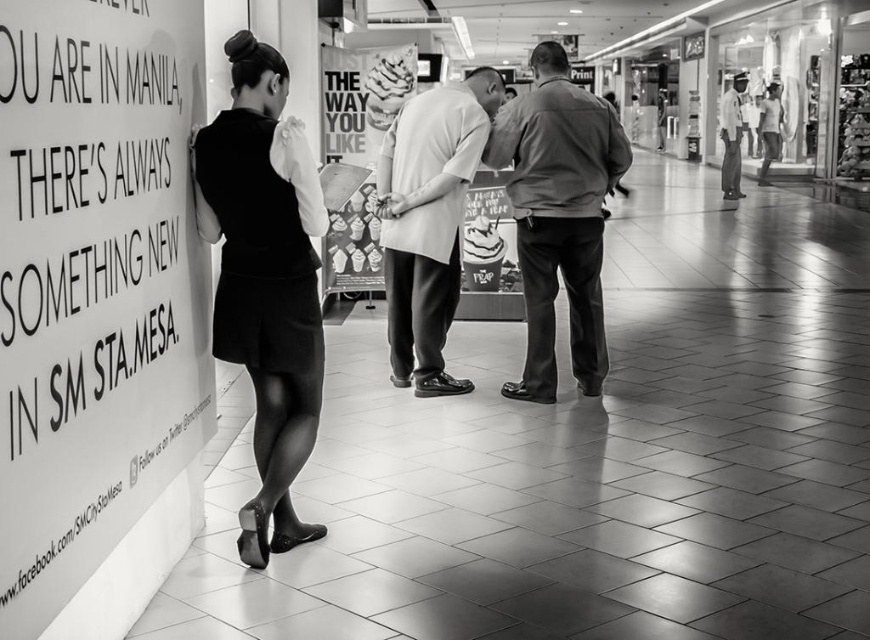
Is smooth paper sign at left to the left of smooth brown shirt at center from the viewer's perspective?

Yes, smooth paper sign at left is to the left of smooth brown shirt at center.

Does smooth paper sign at left appear on the right side of smooth brown shirt at center?

In fact, smooth paper sign at left is to the left of smooth brown shirt at center.

Image resolution: width=870 pixels, height=640 pixels. In order to click on smooth paper sign at left in this screenshot , I will do `click(95, 288)`.

Looking at this image, how far apart are smooth brown shirt at center and smooth beige shirt at center?

smooth brown shirt at center and smooth beige shirt at center are 22.36 inches apart from each other.

Who is more distant from viewer, (589, 266) or (443, 296)?

Positioned behind is point (443, 296).

Does point (484, 157) come in front of point (405, 225)?

No, (484, 157) is further to viewer.

Image resolution: width=870 pixels, height=640 pixels. Identify the location of smooth brown shirt at center. (559, 216).

Describe the element at coordinates (95, 288) in the screenshot. Image resolution: width=870 pixels, height=640 pixels. I see `smooth paper sign at left` at that location.

Between smooth paper sign at left and light blue uniform at center, which one is positioned lower?

smooth paper sign at left is lower down.

Which is behind, point (96, 317) or point (721, 172)?

Point (721, 172)

You are a GUI agent. You are given a task and a screenshot of the screen. Output one action in this format:
    pyautogui.click(x=<x>, y=<y>)
    Task: Click on the smooth paper sign at left
    
    Given the screenshot: What is the action you would take?
    pyautogui.click(x=95, y=288)